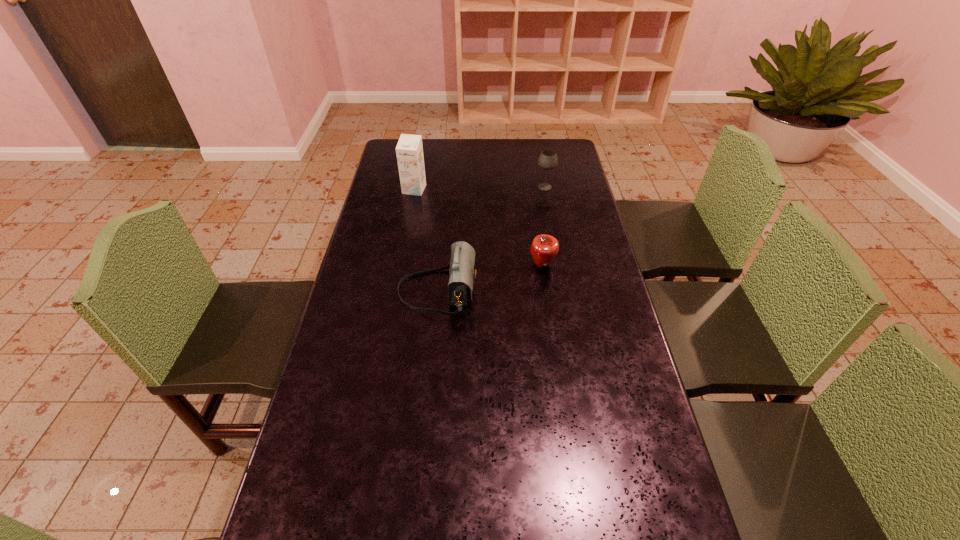
You are a GUI agent. You are given a task and a screenshot of the screen. Output one action in this format:
    pyautogui.click(x=<x>, y=<y>)
    Task: Click on the closest object to the wineglass
    
    Given the screenshot: What is the action you would take?
    (544, 248)

Select which object appears as the second closest to the shoulder bag. Please provide its 2D coordinates. Your answer should be formatted as a tuple, i.e. [(x, y)], where the tuple contains the x and y coordinates of a point satisfying the conditions above.

[(409, 150)]

This screenshot has width=960, height=540. I want to click on vacant space that satisfies the following two spatial constraints: 1. on the back side of the shoulder bag; 2. on the left side of the apple, so tap(440, 265).

I want to click on free spot that satisfies the following two spatial constraints: 1. on the back side of the wineglass; 2. on the right side of the carton, so click(x=415, y=187).